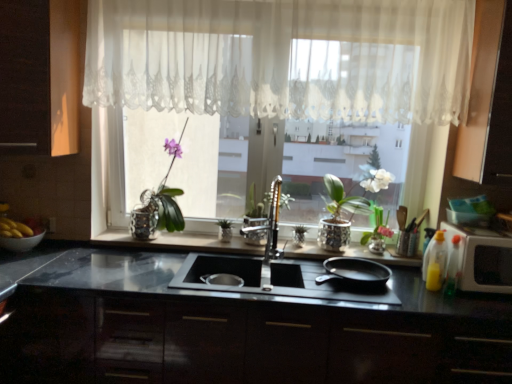
The image size is (512, 384). Find the location of `vacant space situated above white glossy microwave at right (from a real-world perspective)`. vacant space situated above white glossy microwave at right (from a real-world perspective) is located at coordinates (490, 229).